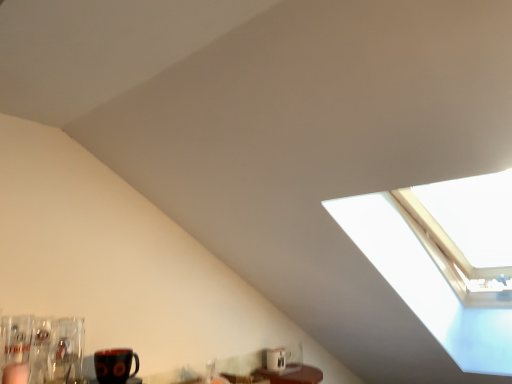
What is the approximate height of matte black mug at lower left?

It is 0.51 inches.

This screenshot has height=384, width=512. I want to click on matte black mug at lower left, so click(134, 380).

Measure the distance between matte black mug at lower left and camera.

matte black mug at lower left and camera are 4.13 feet apart.

The height and width of the screenshot is (384, 512). Describe the element at coordinates (134, 380) in the screenshot. I see `matte black mug at lower left` at that location.

The width and height of the screenshot is (512, 384). I want to click on matte black mug at lower left, so click(134, 380).